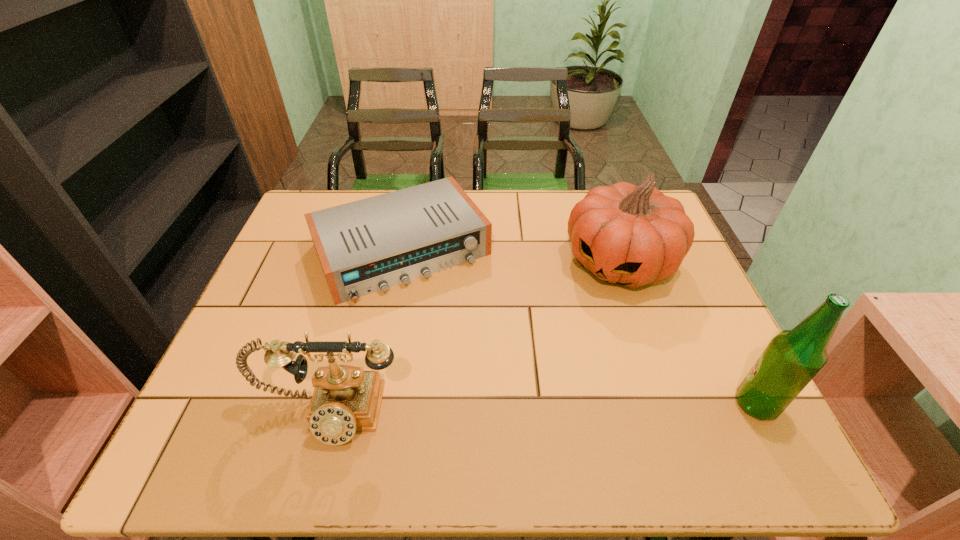
In order to click on empty space that is in between the radio receiver and the beer bottle in this screenshot , I will do `click(579, 327)`.

Locate an element on the screen. Image resolution: width=960 pixels, height=540 pixels. empty space that is in between the beer bottle and the radio receiver is located at coordinates (579, 327).

You are a GUI agent. You are given a task and a screenshot of the screen. Output one action in this format:
    pyautogui.click(x=<x>, y=<y>)
    Task: Click on the free space between the radio receiver and the pumpkin
    The height and width of the screenshot is (540, 960).
    Given the screenshot: What is the action you would take?
    [x=511, y=256]

Find the location of a particular element. This screenshot has width=960, height=540. vacant space in between the radio receiver and the pumpkin is located at coordinates (511, 256).

You are a GUI agent. You are given a task and a screenshot of the screen. Output one action in this format:
    pyautogui.click(x=<x>, y=<y>)
    Task: Click on the vacant region between the third tallest object and the radio receiver
    
    Given the screenshot: What is the action you would take?
    pyautogui.click(x=365, y=332)

Locate an element on the screen. free space between the radio receiver and the third tallest object is located at coordinates (365, 332).

Where is `free space that is in between the telephone and the beer bottle`? The height and width of the screenshot is (540, 960). free space that is in between the telephone and the beer bottle is located at coordinates (542, 409).

What are the coordinates of `blank region between the third tallest object and the shortest object` in the screenshot? It's located at 365,332.

Where is `empty space that is in between the pumpkin and the third tallest object`? The width and height of the screenshot is (960, 540). empty space that is in between the pumpkin and the third tallest object is located at coordinates (474, 338).

Identify the location of unoccupied position between the shortest object and the pumpkin. The width and height of the screenshot is (960, 540). (511, 256).